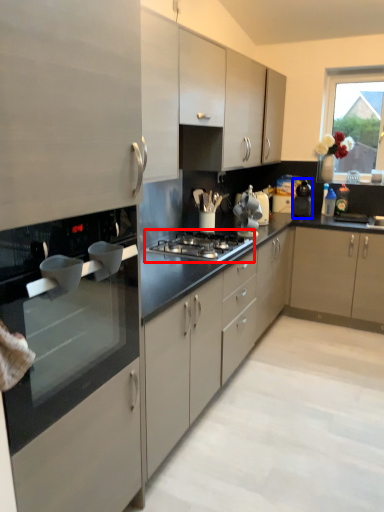
Question: Among these objects, which one is farthest to the camera, gas stove (highlighted by a red box) or kitchen appliance (highlighted by a blue box)?

Choices:
 (A) gas stove
 (B) kitchen appliance

Answer: (B)